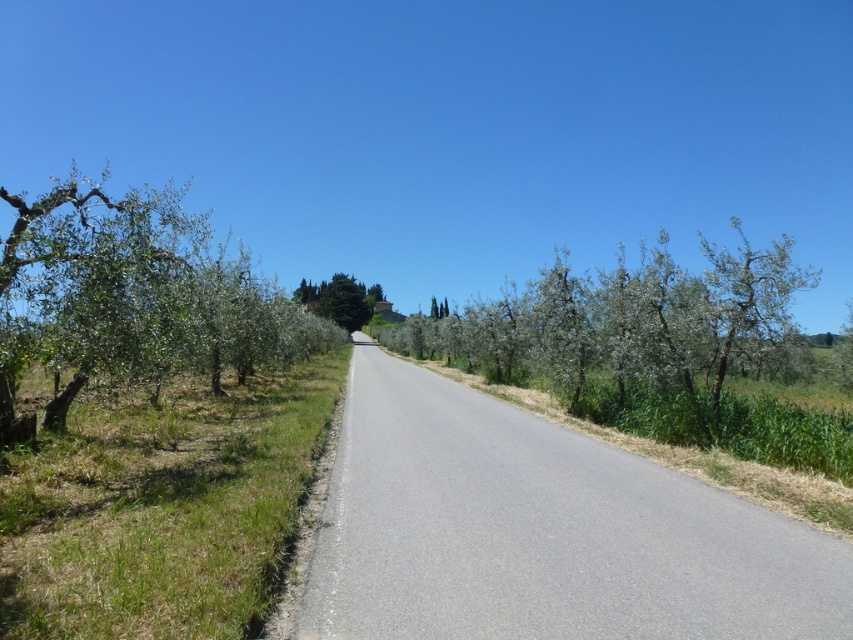
Does green leafy tree at left appear over green leafy tree at center?

Yes, green leafy tree at left is above green leafy tree at center.

Is point (102, 344) positioned in front of point (305, 296)?

Yes.

Locate an element on the screen. The height and width of the screenshot is (640, 853). green leafy tree at left is located at coordinates (132, 300).

The width and height of the screenshot is (853, 640). Find the location of `green leafy trees at center`. green leafy trees at center is located at coordinates (635, 337).

Which is more to the right, green leafy trees at center or green leafy tree at left?

From the viewer's perspective, green leafy trees at center appears more on the right side.

Between point (738, 278) and point (285, 332), which one is positioned in front?

Point (738, 278) is in front.

Image resolution: width=853 pixels, height=640 pixels. I want to click on green leafy trees at center, so click(x=635, y=337).

Who is more forward, (x=583, y=289) or (x=361, y=285)?

Positioned in front is point (x=583, y=289).

Is green leafy trees at center above green leafy tree at center?

Actually, green leafy trees at center is below green leafy tree at center.

In order to click on green leafy trees at center in this screenshot , I will do `click(635, 337)`.